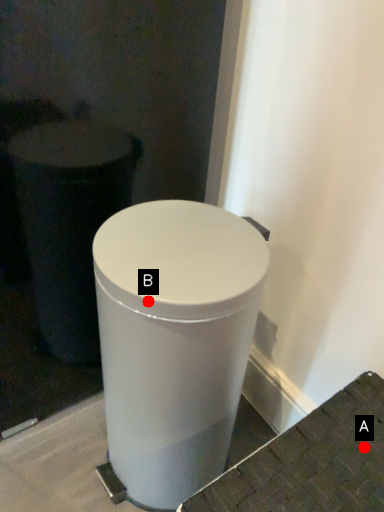
Question: Two points are circled on the image, labeled by A and B beside each circle. Which point is farther from the camera taking this photo?

Choices:
 (A) A is further
 (B) B is further

Answer: (B)